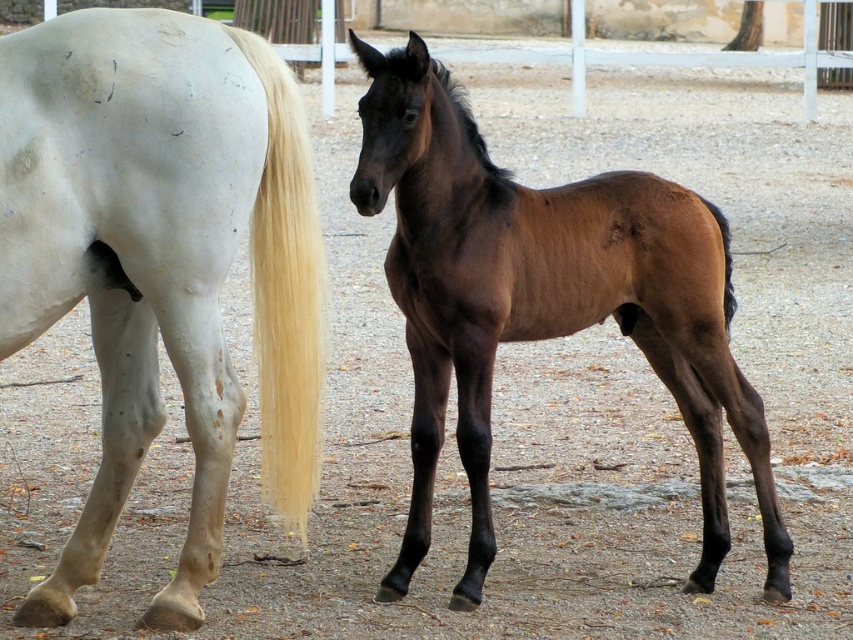
Question: Which point is farther from the camera taking this photo?

Choices:
 (A) (399, 138)
 (B) (265, 348)
 (C) (57, 45)

Answer: (A)

Question: Observing the image, what is the correct spatial positioning of brown glossy horse at center in reference to brown glossy tail at right?

Choices:
 (A) below
 (B) above

Answer: (A)

Question: Can you confirm if brown glossy horse at center is bigger than black silky mane at center?

Choices:
 (A) yes
 (B) no

Answer: (A)

Question: Does brown glossy horse at center have a greater width compared to brown glossy tail at right?

Choices:
 (A) yes
 (B) no

Answer: (A)

Question: Which of these objects is positioned closest to the white glossy horse at left?

Choices:
 (A) black silky mane at center
 (B) brown glossy horse at center
 (C) blonde silky tail at left

Answer: (C)

Question: Which of the following is the closest to the observer?

Choices:
 (A) (45, 618)
 (B) (724, 310)
 (C) (473, 131)
 (D) (405, 291)

Answer: (A)